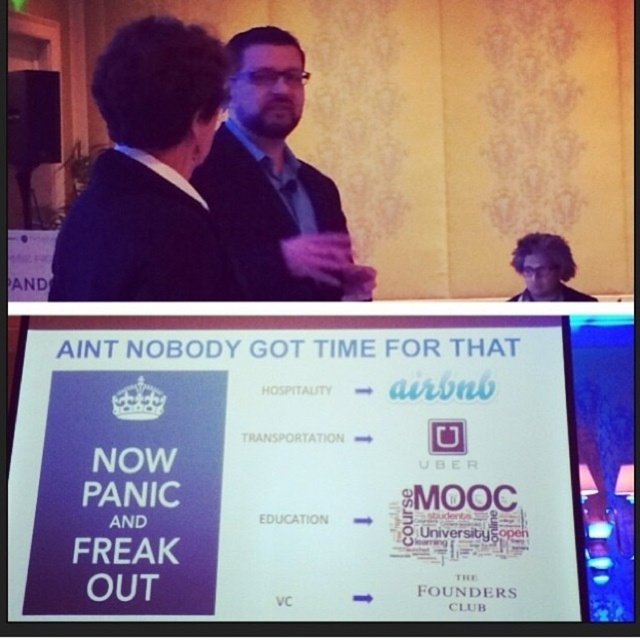
You are standing in a conference room and see the matte black jacket at center and the black matte suit at upper left. Which one is closer to you?

The matte black jacket at center is closer to you because it is further to the viewer than the black matte suit at upper left.

You are standing in front of the presentation slide displayed on the screen in the lower part of the image. There are two points marked on the slide. Which point is closer to you, point (x=97, y=218) or point (x=582, y=298)?

Point (x=97, y=218) is closer to the viewer than point (x=582, y=298).

Looking at the upper part of the image, you notice the dark curly hair at upper right and the purple matte business suit at upper center. Which of these two elements is taller?

The dark curly hair at upper right is taller than the purple matte business suit at upper center according to the description.